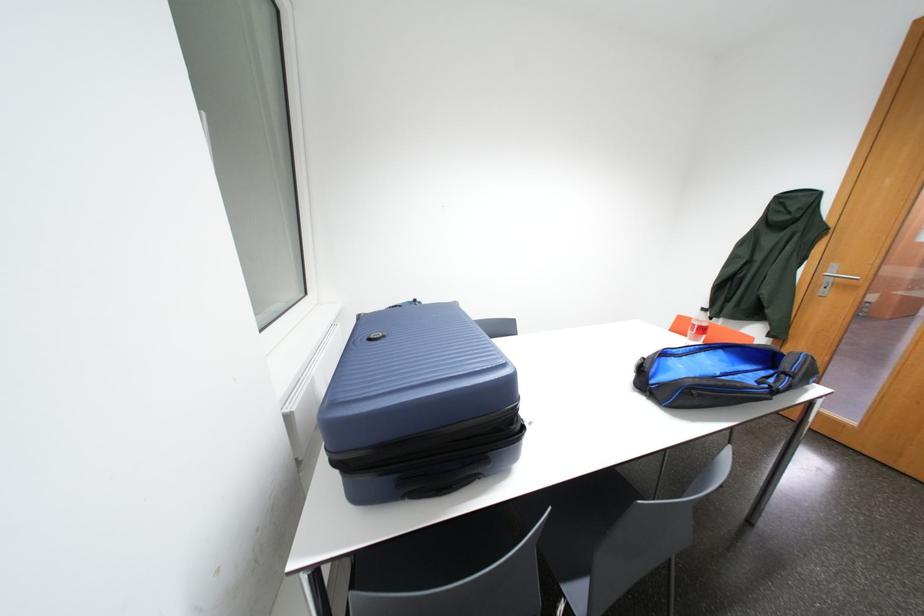
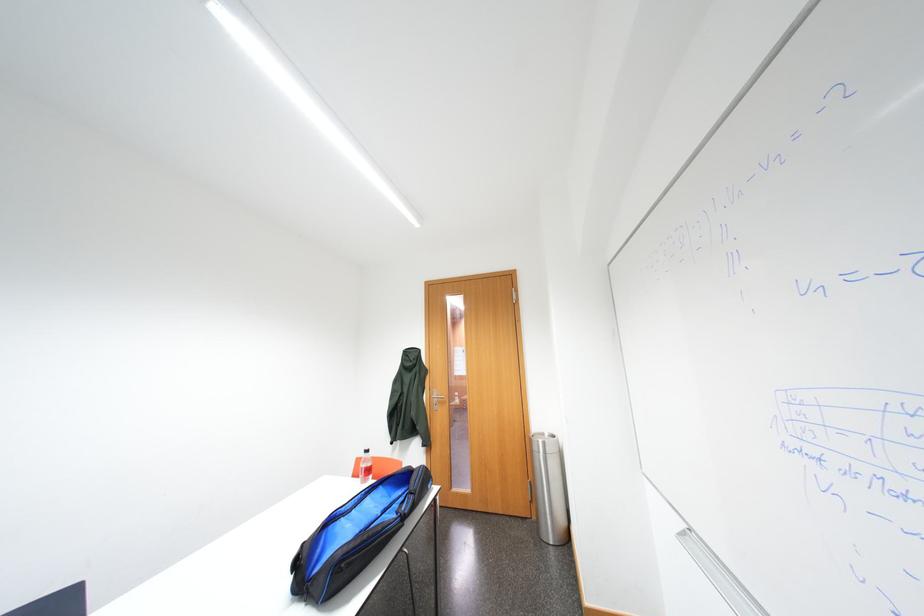
How did the camera likely rotate?

The camera rotated toward right-up.